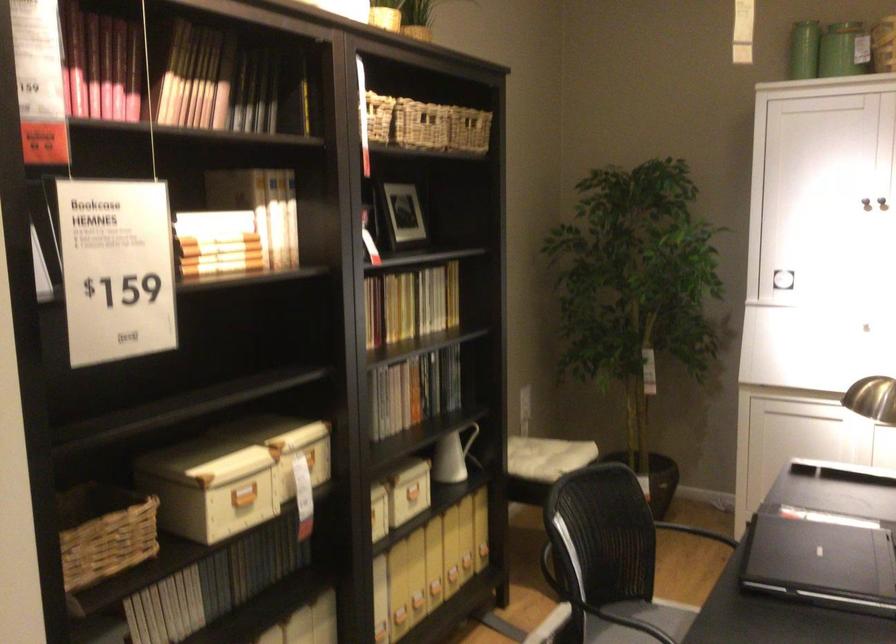
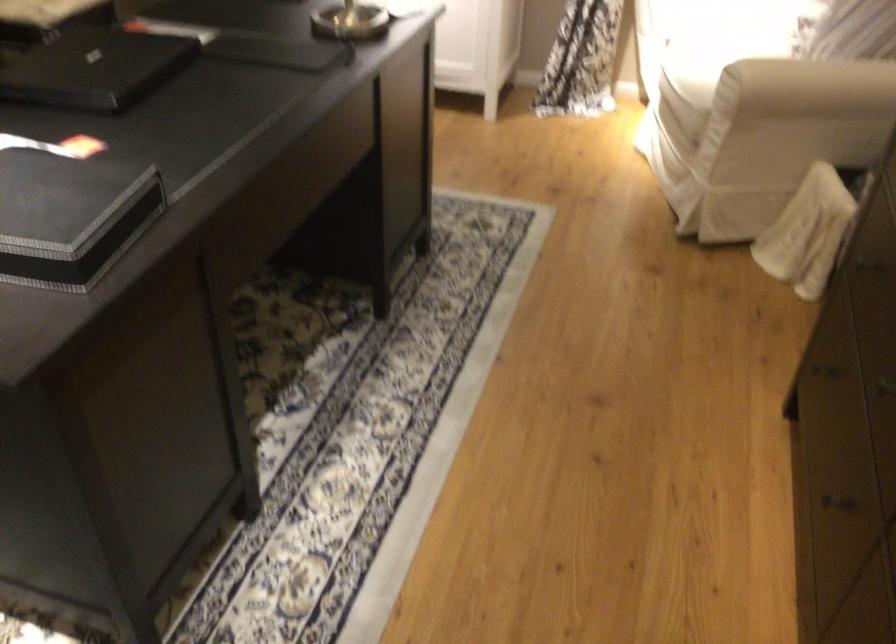
How did the camera likely rotate?

The camera rotated toward right-down.